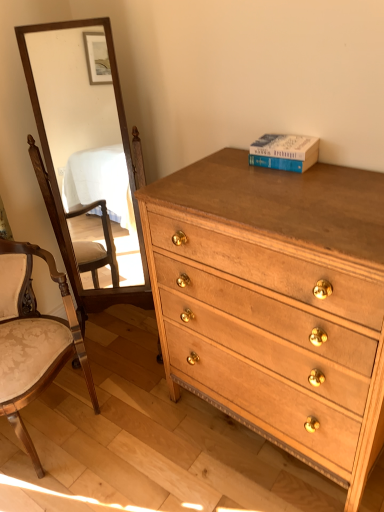
The width and height of the screenshot is (384, 512). I want to click on vacant space underneath wooden mirror at left (from a real-world perspective), so click(124, 345).